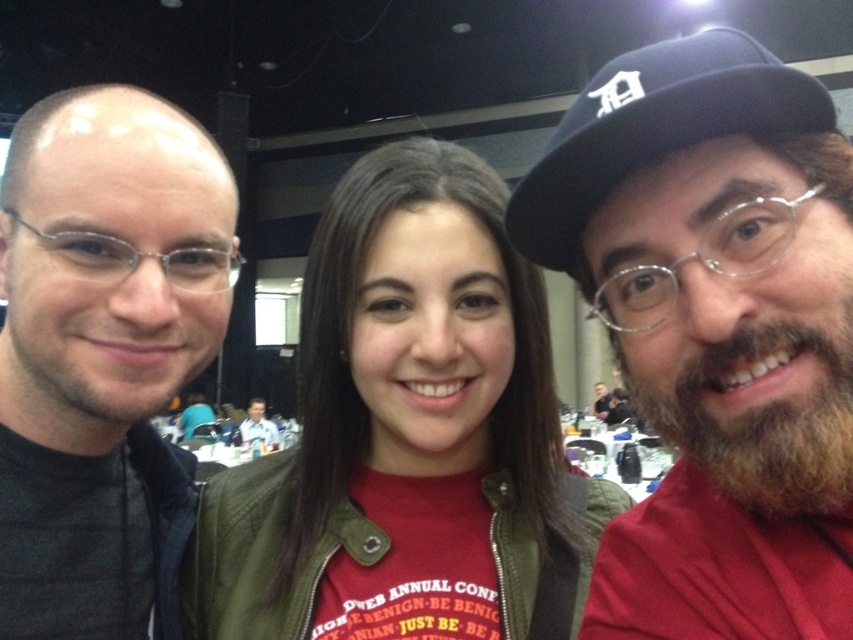
Is bearded man at right to the left of matte black jacket at left from the viewer's perspective?

Incorrect, bearded man at right is not on the left side of matte black jacket at left.

Can you confirm if bearded man at right is positioned to the right of matte black jacket at left?

Correct, you'll find bearded man at right to the right of matte black jacket at left.

Locate an element on the screen. bearded man at right is located at coordinates (714, 330).

Which of these two, dark blue fabric baseball cap at right or smooth skin face at center, stands taller?

smooth skin face at center

Between dark blue fabric baseball cap at right and smooth skin face at center, which one is positioned higher?

dark blue fabric baseball cap at right is higher up.

Which is behind, point (817, 131) or point (245, 419)?

Positioned behind is point (245, 419).

Locate an element on the screen. The height and width of the screenshot is (640, 853). dark blue fabric baseball cap at right is located at coordinates (654, 128).

Between point (759, 262) and point (677, 60), which one is positioned behind?

The point (677, 60) is more distant.

Describe the element at coordinates (714, 330) in the screenshot. I see `bearded man at right` at that location.

At what (x,y) coordinates should I click in order to perform the action: click on bearded man at right. Please return your answer as a coordinate pair (x, y). The image size is (853, 640). Looking at the image, I should click on (714, 330).